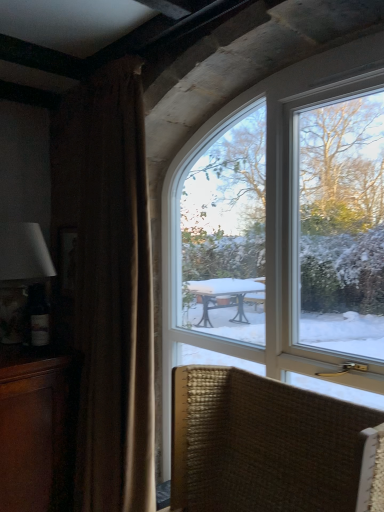
Locate an element on the screen. woven fabric chair at lower right is located at coordinates (268, 446).

What do you see at coordinates (268, 446) in the screenshot?
I see `woven fabric chair at lower right` at bounding box center [268, 446].

The width and height of the screenshot is (384, 512). What are the coordinates of `matte white lampshade at left` in the screenshot? It's located at (20, 274).

Where is `brown velvet curtain at left`? This screenshot has height=512, width=384. brown velvet curtain at left is located at coordinates (108, 284).

Locate an element on the screen. The height and width of the screenshot is (512, 384). clear glass window at upper center is located at coordinates (282, 231).

Is point (123, 227) behind point (37, 496)?

That is False.

Is brown velvet curtain at left spatially inside wooden cabinet at left, or outside of it?

brown velvet curtain at left is not inside wooden cabinet at left, it's outside.

This screenshot has height=512, width=384. Identify the location of curtain above the wooden cabinet at left (from a real-world perspective). (108, 284).

Consider the image. Which of these two, clear glass window at upper center or matte white lampshade at left, is smaller?

With smaller size is matte white lampshade at left.

Is the surface of clear glass window at upper center in direct contact with matte white lampshade at left?

No.

Considering the positions of objects clear glass window at upper center and matte white lampshade at left in the image provided, who is in front, clear glass window at upper center or matte white lampshade at left?

clear glass window at upper center.

Visually, is matte white lampshade at left positioned to the left or to the right of wooden cabinet at left?

Clearly, matte white lampshade at left is on the left of wooden cabinet at left in the image.

Would you consider matte white lampshade at left to be distant from wooden cabinet at left?

Actually, matte white lampshade at left and wooden cabinet at left are a little close together.

Considering the positions of objects matte white lampshade at left and wooden cabinet at left in the image provided, who is in front, matte white lampshade at left or wooden cabinet at left?

Positioned in front is wooden cabinet at left.

Does point (355, 327) appear closer or farther from the camera than point (136, 498)?

Clearly, point (355, 327) is closer to the camera than point (136, 498).

Do you think clear glass window at upper center is within brown velvet curtain at left, or outside of it?

clear glass window at upper center cannot be found inside brown velvet curtain at left.

From a real-world perspective, is clear glass window at upper center located beneath brown velvet curtain at left?

No, from a real-world perspective, clear glass window at upper center is not under brown velvet curtain at left.

What's the angular difference between matte white lampshade at left and clear glass window at upper center's facing directions?

The angle between the facing direction of matte white lampshade at left and the facing direction of clear glass window at upper center is 86.8 degrees.

Is matte white lampshade at left taller or shorter than clear glass window at upper center?

In the image, matte white lampshade at left appears to be shorter than clear glass window at upper center.

Considering the points (18, 334) and (328, 103), which point is behind, point (18, 334) or point (328, 103)?

The point (18, 334) is behind.

From the image's perspective, does matte white lampshade at left appear lower than clear glass window at upper center?

Indeed, from the image's perspective, matte white lampshade at left is shown beneath clear glass window at upper center.

Considering the relative sizes of brown velvet curtain at left and woven fabric chair at lower right in the image provided, is brown velvet curtain at left shorter than woven fabric chair at lower right?

In fact, brown velvet curtain at left may be taller than woven fabric chair at lower right.

Considering the positions of objects brown velvet curtain at left and woven fabric chair at lower right in the image provided, who is more to the right, brown velvet curtain at left or woven fabric chair at lower right?

woven fabric chair at lower right is more to the right.

How different are the orientations of brown velvet curtain at left and woven fabric chair at lower right in degrees?

0.448 degrees separate the facing orientations of brown velvet curtain at left and woven fabric chair at lower right.

Is brown velvet curtain at left with woven fabric chair at lower right?

They are not placed beside each other.

Is point (291, 478) positioned behind point (126, 434)?

No, (291, 478) is closer to viewer.

From the image's perspective, is woven fabric chair at lower right beneath brown velvet curtain at left?

Correct, woven fabric chair at lower right appears lower than brown velvet curtain at left in the image.

Is woven fabric chair at lower right bigger than brown velvet curtain at left?

Incorrect, woven fabric chair at lower right is not larger than brown velvet curtain at left.

Are woven fabric chair at lower right and brown velvet curtain at left located far from each other?

They are positioned close to each other.

Locate an element on the screen. cabinetry lying on the left of brown velvet curtain at left is located at coordinates (34, 432).

What are the coordinates of `table lamp below the clear glass window at upper center (from the image's perspective)` in the screenshot? It's located at (20, 274).

When comparing their distances from brown velvet curtain at left, does wooden cabinet at left or woven fabric chair at lower right seem closer?

wooden cabinet at left is closer to brown velvet curtain at left.

From the image, which object appears to be nearer to wooden cabinet at left, matte white lampshade at left or brown velvet curtain at left?

brown velvet curtain at left lies closer to wooden cabinet at left than the other object.

Looking at the image, which one is located closer to brown velvet curtain at left, clear glass window at upper center or wooden cabinet at left?

Based on the image, wooden cabinet at left appears to be nearer to brown velvet curtain at left.

Which object lies further to the anchor point matte white lampshade at left, wooden cabinet at left or clear glass window at upper center?

The object further to matte white lampshade at left is clear glass window at upper center.

Considering their positions, is matte white lampshade at left positioned further to woven fabric chair at lower right than clear glass window at upper center?

matte white lampshade at left.

Which object lies nearer to the anchor point clear glass window at upper center, wooden cabinet at left or brown velvet curtain at left?

Based on the image, brown velvet curtain at left appears to be nearer to clear glass window at upper center.

Based on their spatial positions, is matte white lampshade at left or woven fabric chair at lower right further from brown velvet curtain at left?

The object further to brown velvet curtain at left is woven fabric chair at lower right.

When comparing their distances from matte white lampshade at left, does clear glass window at upper center or woven fabric chair at lower right seem further?

woven fabric chair at lower right is positioned further to the anchor matte white lampshade at left.

Find the location of a particular element. Image resolution: width=384 pixels, height=512 pixels. curtain situated between matte white lampshade at left and clear glass window at upper center from left to right is located at coordinates (108, 284).

Find the location of a particular element. The width and height of the screenshot is (384, 512). curtain situated between wooden cabinet at left and clear glass window at upper center from left to right is located at coordinates (108, 284).

At what (x,y) coordinates should I click in order to perform the action: click on cabinetry situated between matte white lampshade at left and clear glass window at upper center from left to right. Please return your answer as a coordinate pair (x, y). The width and height of the screenshot is (384, 512). Looking at the image, I should click on (34, 432).

The width and height of the screenshot is (384, 512). Find the location of `cabinetry located between woven fabric chair at lower right and matte white lampshade at left in the depth direction`. cabinetry located between woven fabric chair at lower right and matte white lampshade at left in the depth direction is located at coordinates (34, 432).